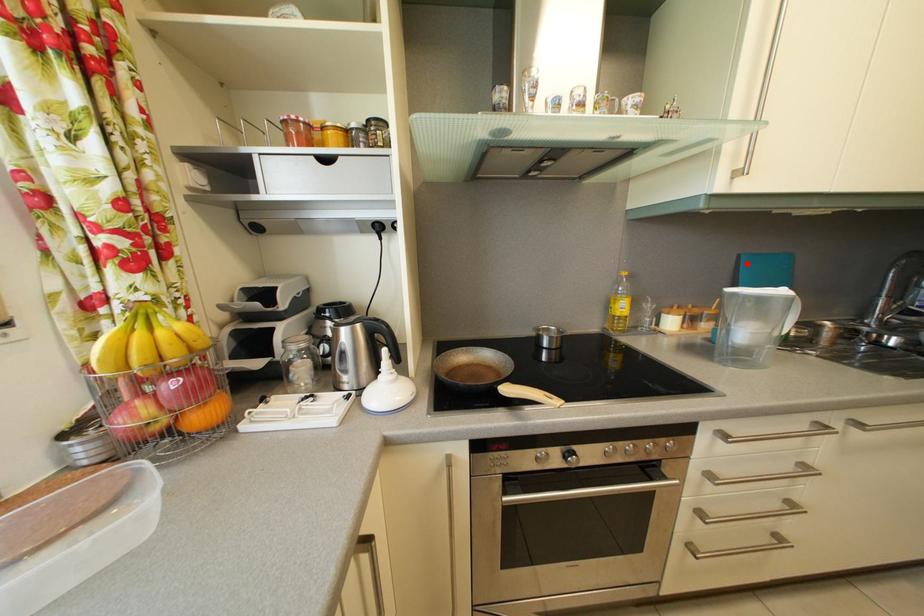
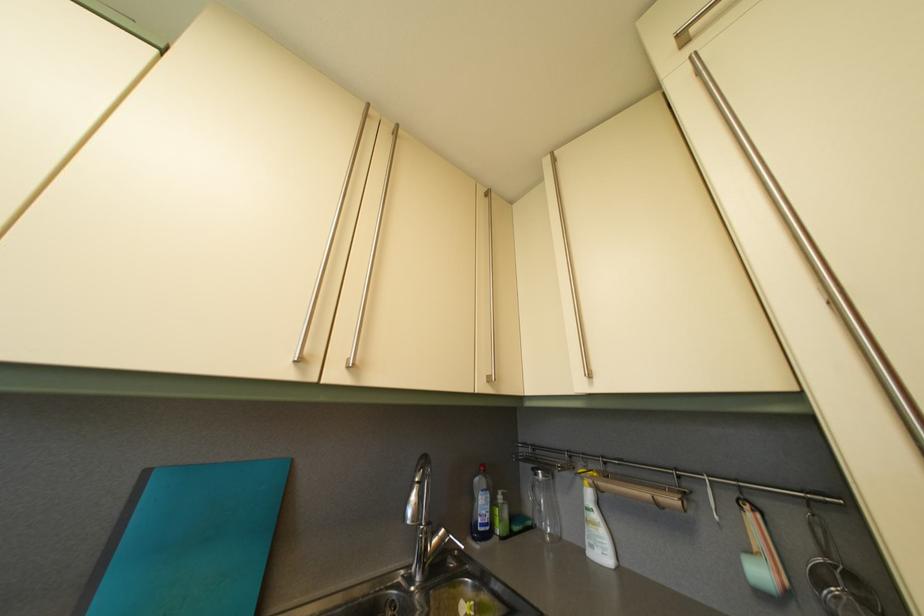
Find the pixel in the second image that matches the highlighted location in the first image.

(154, 480)